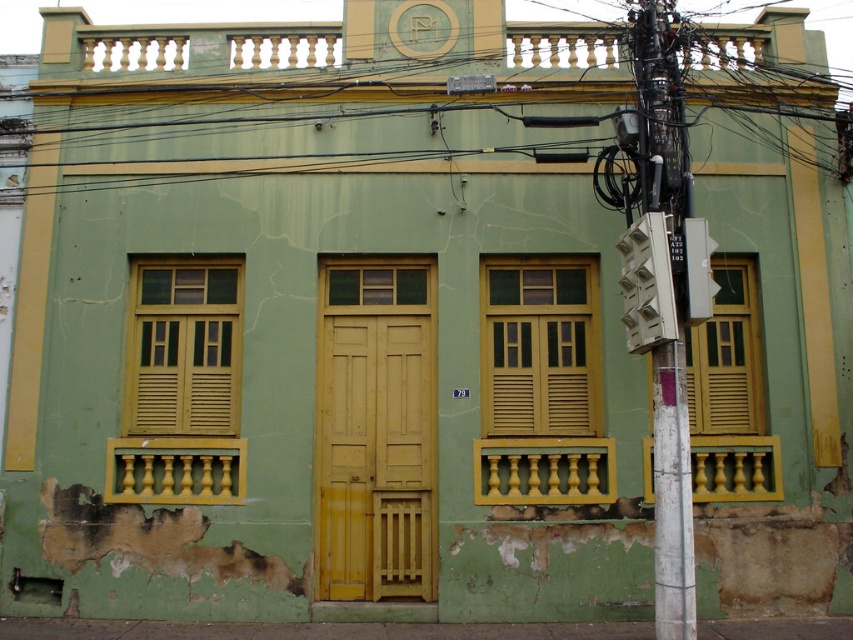
Looking at this image, you are a delivery person trying to park your van in front of the building. The van has a height restriction of 2.5 meters. Given the black wire at upper center and the metallic gray traffic light at right, which object is taller and could potentially block the van from passing?

The black wire at upper center is taller than the metallic gray traffic light at right. Since the van has a height restriction of 2.5 meters, you should check the height of the black wire at upper center to ensure it doesn

You are a city planner assessing the visibility of traffic signals in the area. Given the presence of the white plastic traffic light at right and the yellow matte shutter at right, which object is more likely to be seen from a greater distance?

The white plastic traffic light at right is larger in size than the yellow matte shutter at right, so it will be more visible from a greater distance.

You are a pedestrian standing on the sidewalk in front of the building. You notice the white plastic traffic light at right and the black wire at upper center. Which object is closer to you?

The white plastic traffic light at right is closer to you because it is in front of the black wire at upper center.